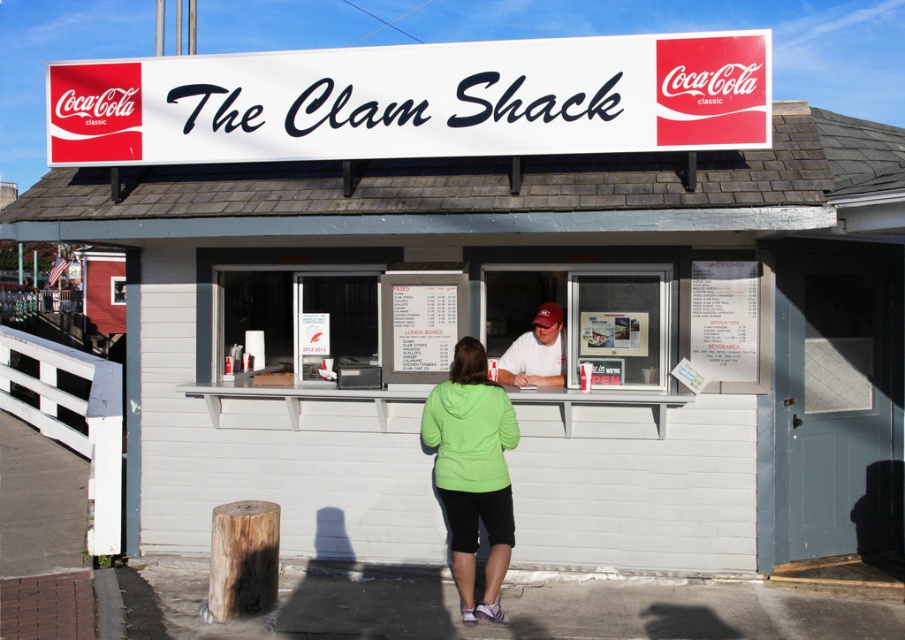
Question: From the image, what is the correct spatial relationship of green matte hoodie at center in relation to matte white shirt at center?

Choices:
 (A) above
 (B) below

Answer: (B)

Question: Which point appears closest to the camera in this image?

Choices:
 (A) (436, 448)
 (B) (556, 337)

Answer: (A)

Question: Does green matte hoodie at center have a greater width compared to matte white shirt at center?

Choices:
 (A) no
 (B) yes

Answer: (B)

Question: Is green matte hoodie at center below matte white shirt at center?

Choices:
 (A) no
 (B) yes

Answer: (B)